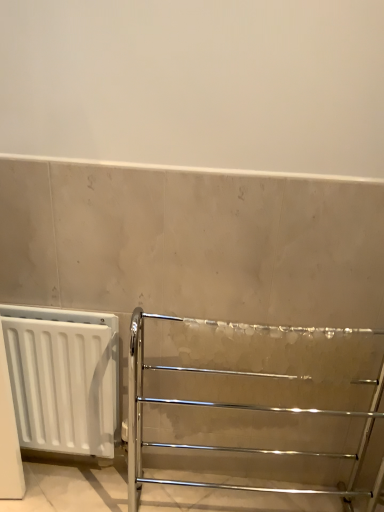
Question: From the image's perspective, is white matte radiator at left above or below polished chrome towel rack at center?

Choices:
 (A) above
 (B) below

Answer: (A)

Question: From a real-world perspective, is white matte radiator at left positioned above or below polished chrome towel rack at center?

Choices:
 (A) above
 (B) below

Answer: (B)

Question: Would you say white matte radiator at left is inside or outside polished chrome towel rack at center?

Choices:
 (A) outside
 (B) inside

Answer: (A)

Question: Does point (231, 402) appear closer or farther from the camera than point (21, 342)?

Choices:
 (A) farther
 (B) closer

Answer: (A)

Question: Relative to white matte radiator at left, is polished chrome towel rack at center in front or behind?

Choices:
 (A) front
 (B) behind

Answer: (A)

Question: From a real-world perspective, is polished chrome towel rack at center positioned above or below white matte radiator at left?

Choices:
 (A) below
 (B) above

Answer: (B)

Question: Is polished chrome towel rack at center bigger or smaller than white matte radiator at left?

Choices:
 (A) big
 (B) small

Answer: (A)